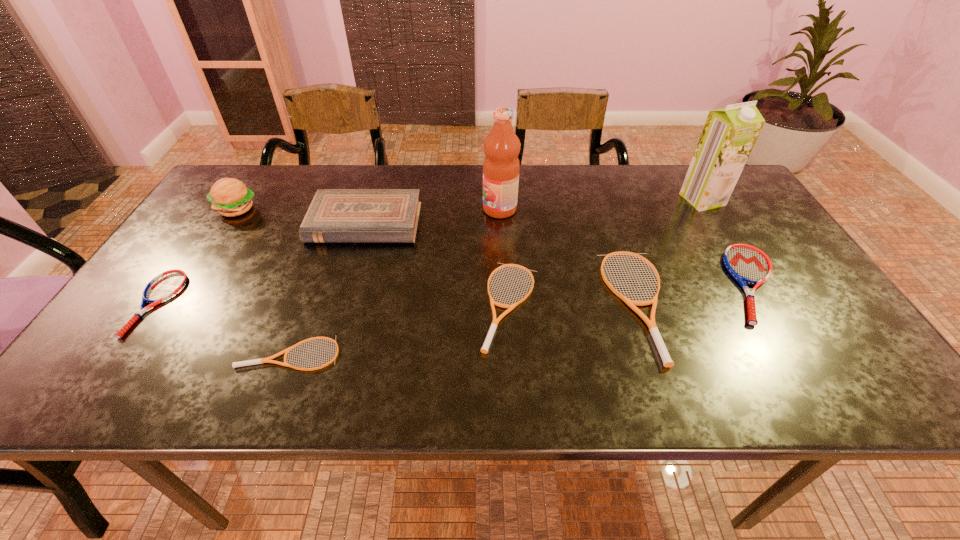
What are the coordinates of `hamburger located in the left edge section of the desktop` in the screenshot? It's located at (229, 196).

The height and width of the screenshot is (540, 960). I want to click on tennis racket located in the left edge section of the desktop, so click(165, 285).

At what (x,y) coordinates should I click in order to perform the action: click on soya milk present at the right edge. Please return your answer as a coordinate pair (x, y). Looking at the image, I should click on (729, 134).

Where is `tennis racket positioned at the right edge`? This screenshot has width=960, height=540. tennis racket positioned at the right edge is located at coordinates (747, 264).

The height and width of the screenshot is (540, 960). I want to click on object at the far left corner, so click(229, 196).

What are the coordinates of `object that is at the far right corner` in the screenshot? It's located at (729, 134).

The height and width of the screenshot is (540, 960). What are the coordinates of `vacant space at the far edge` in the screenshot? It's located at (268, 201).

I want to click on free space at the near edge of the desktop, so click(x=335, y=400).

Locate an element on the screen. Image resolution: width=960 pixels, height=540 pixels. blank space at the left edge of the desktop is located at coordinates (208, 285).

The width and height of the screenshot is (960, 540). Find the location of `free space at the right edge`. free space at the right edge is located at coordinates (773, 303).